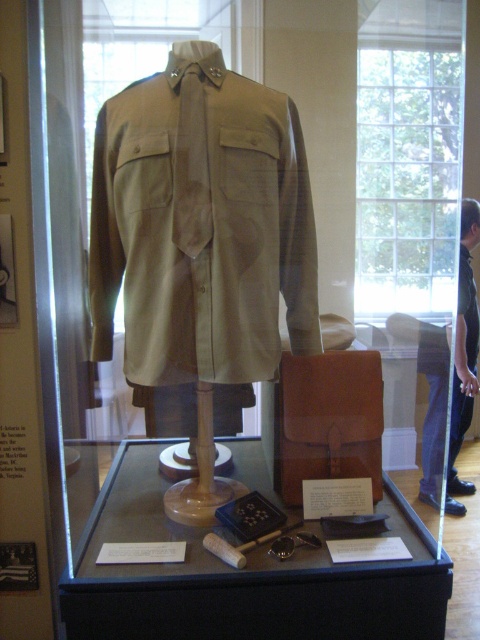
You are a visitor standing in front of the display case. You see the khaki cotton shirt at center and the matte brown leather case at center. Which object is positioned to the left side?

The khaki cotton shirt at center is positioned to the left of the matte brown leather case at center.

You are a museum visitor observing the display case. You notice the khaki cotton shirt at center and the matte brown leather case at center. Which object is positioned higher in the display?

The khaki cotton shirt at center is much taller than the matte brown leather case at center, so it is positioned higher in the display.

You are a visitor standing in front of the display case. You want to examine the khaki fabric shirt at center and the black leather pants at lower right. Which object is closer to you through the glass?

The black leather pants at lower right is closer to you than the khaki fabric shirt at center because it is further to the viewer.